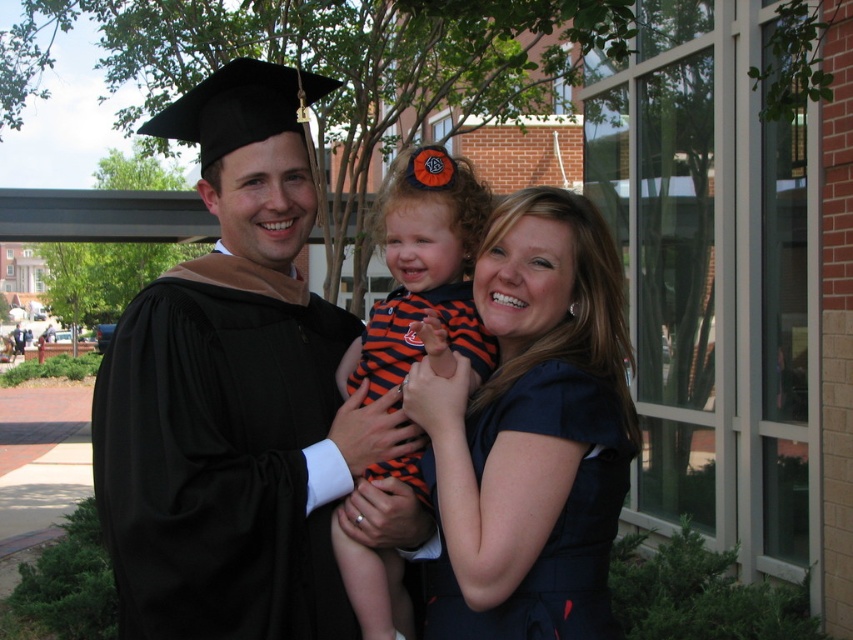
Question: Is matte black graduation gown at center to the right of navy blue dress at center from the viewer's perspective?

Choices:
 (A) yes
 (B) no

Answer: (B)

Question: Which object is farther from the camera taking this photo?

Choices:
 (A) navy blue dress at center
 (B) matte black graduation gown at center

Answer: (B)

Question: Can you confirm if matte black graduation gown at center is wider than striped fabric dress at center?

Choices:
 (A) no
 (B) yes

Answer: (B)

Question: Considering the real-world distances, which object is farthest from the navy blue dress at center?

Choices:
 (A) striped fabric dress at center
 (B) matte black graduation gown at center

Answer: (B)

Question: Where is navy blue dress at center located in relation to striped fabric dress at center in the image?

Choices:
 (A) left
 (B) right

Answer: (B)

Question: Which object is positioned farthest from the striped fabric dress at center?

Choices:
 (A) navy blue dress at center
 (B) matte black graduation gown at center

Answer: (B)